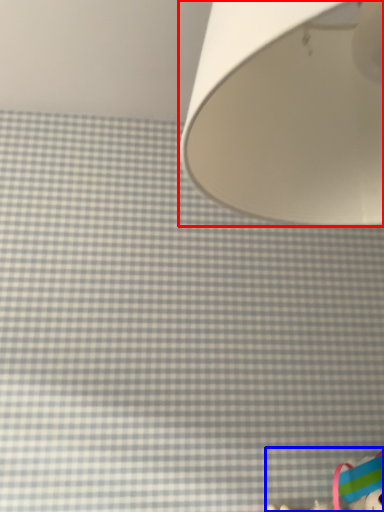
Question: Which of the following is the farthest to the observer, lamp (highlighted by a red box) or toy (highlighted by a blue box)?

Choices:
 (A) lamp
 (B) toy

Answer: (B)